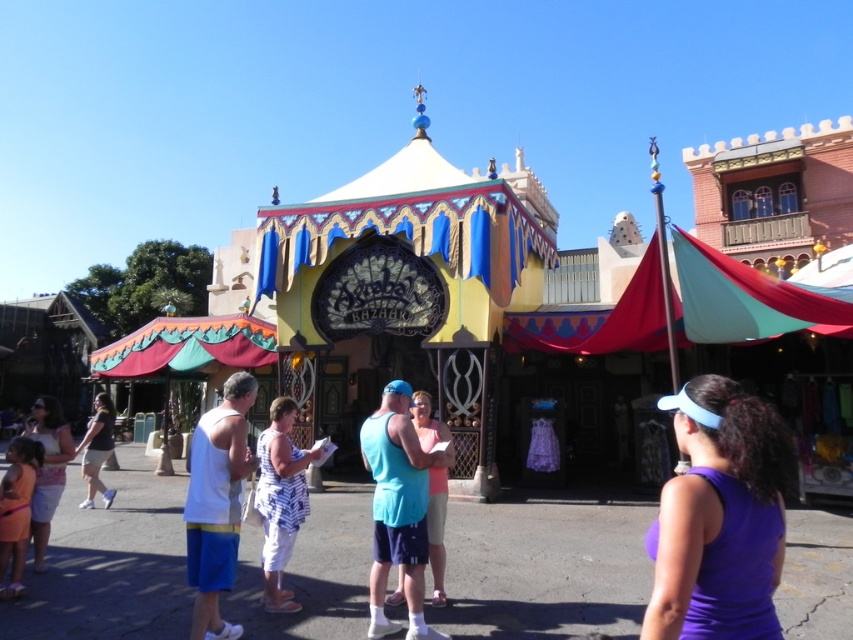
You are a customer at the bazaar and want to find the white printed dress at center. Where should you look relative to the purple fabric visor at center?

The white printed dress at center is located below the purple fabric visor at center, so you should look downward from the purple fabric visor at center to find it.

You are standing at the entrance of the Bazaar and want to determine which of the two points, point (167, 365) or point (42, 420), is closer to you. Based on the spatial relationship between these points, which one would you say is nearer?

Point (167, 365) is further to the viewer than point (42, 420), so the closer point to you is point (42, 420).

You are a photographer standing at the entrance of the pavilion and want to take a photo of the textured fabric canopy at left and the matte white dress at lower left. Which object should you focus on first to ensure it appears sharp in the photo?

The textured fabric canopy at left is further to the viewer than the matte white dress at lower left, so you should focus on the textured fabric canopy at left first to ensure it appears sharp in the photo.